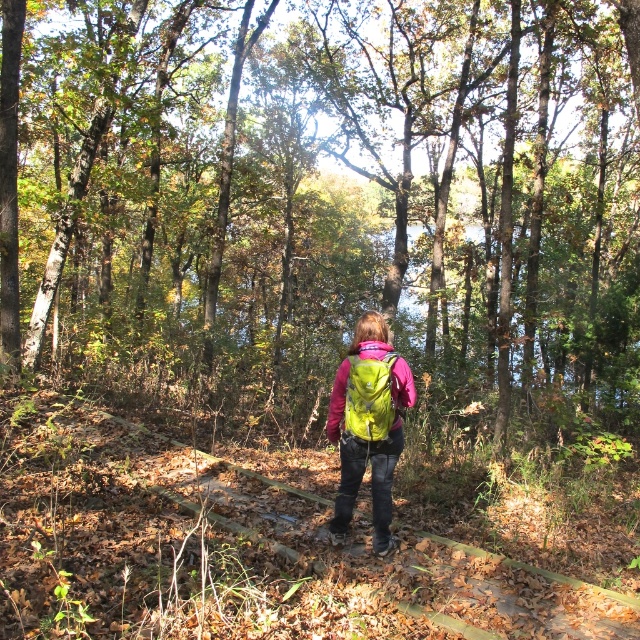
Does neon green backpack at center appear on the right side of matte green backpack at center?

Correct, you'll find neon green backpack at center to the right of matte green backpack at center.

Which of these two, neon green backpack at center or matte green backpack at center, stands shorter?

Standing shorter between the two is matte green backpack at center.

Which is behind, point (401, 388) or point (340, 419)?

Point (340, 419)

Identify the location of neon green backpack at center. Image resolution: width=640 pixels, height=640 pixels. (369, 424).

Can you confirm if green matte backpack at center is positioned below matte green backpack at center?

Actually, green matte backpack at center is above matte green backpack at center.

How far apart are green matte backpack at center and matte green backpack at center?

They are 16.57 meters apart.

Image resolution: width=640 pixels, height=640 pixels. In order to click on green matte backpack at center in this screenshot , I will do `click(324, 200)`.

What are the coordinates of `green matte backpack at center` in the screenshot? It's located at (324, 200).

Measure the distance between green matte backpack at center and camera.

22.62 feet

Is green matte backpack at center thinner than neon green backpack at center?

Incorrect, green matte backpack at center's width is not less than neon green backpack at center's.

This screenshot has width=640, height=640. What do you see at coordinates (324, 200) in the screenshot?
I see `green matte backpack at center` at bounding box center [324, 200].

Identify the location of green matte backpack at center. The width and height of the screenshot is (640, 640). (324, 200).